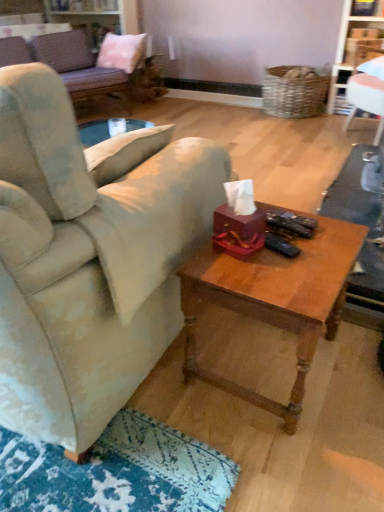
Locate an element on the screen. The image size is (384, 512). free point above wooden coffee table at center (from a real-world perspective) is located at coordinates (282, 250).